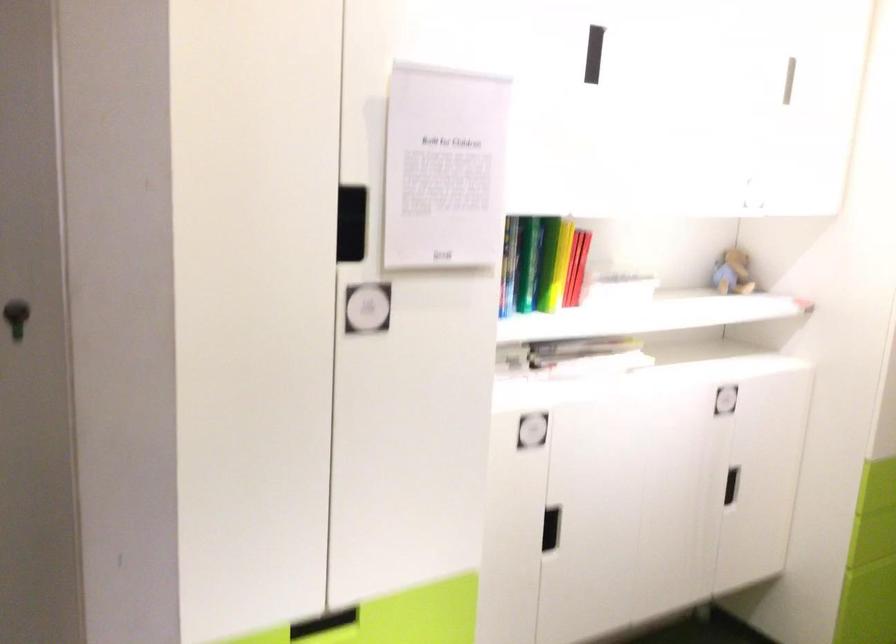
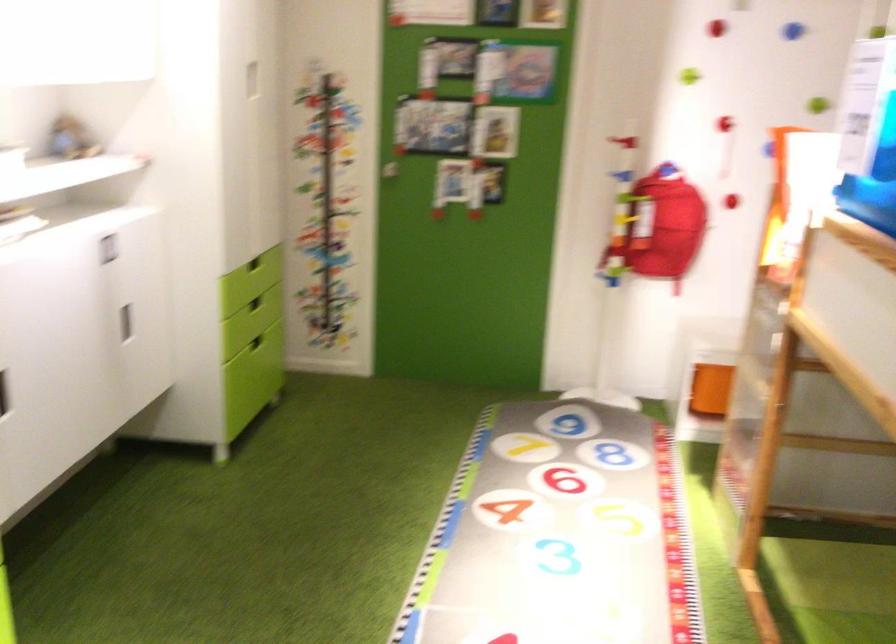
In the second image, find the point that corresponds to [710,486] in the first image.

(125, 323)